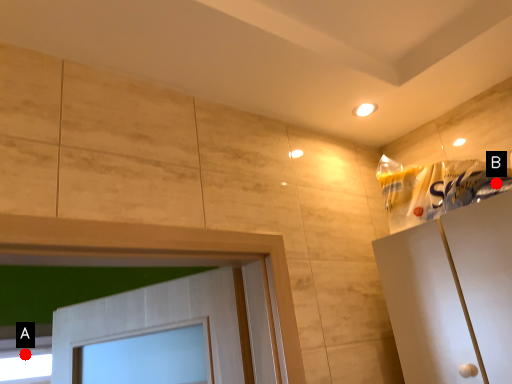
Question: Two points are circled on the image, labeled by A and B beside each circle. Which point is closer to the camera?

Choices:
 (A) A is closer
 (B) B is closer

Answer: (B)